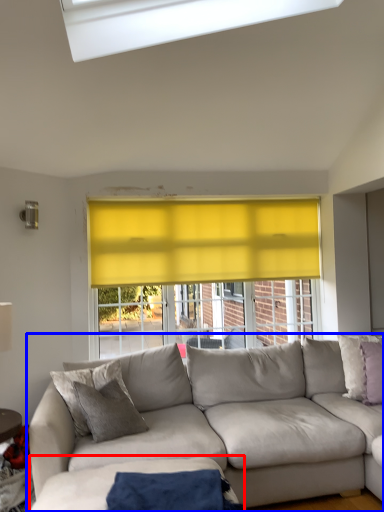
Question: Which of the following is the farthest to the observer, plain (highlighted by a red box) or studio couch (highlighted by a blue box)?

Choices:
 (A) plain
 (B) studio couch

Answer: (B)